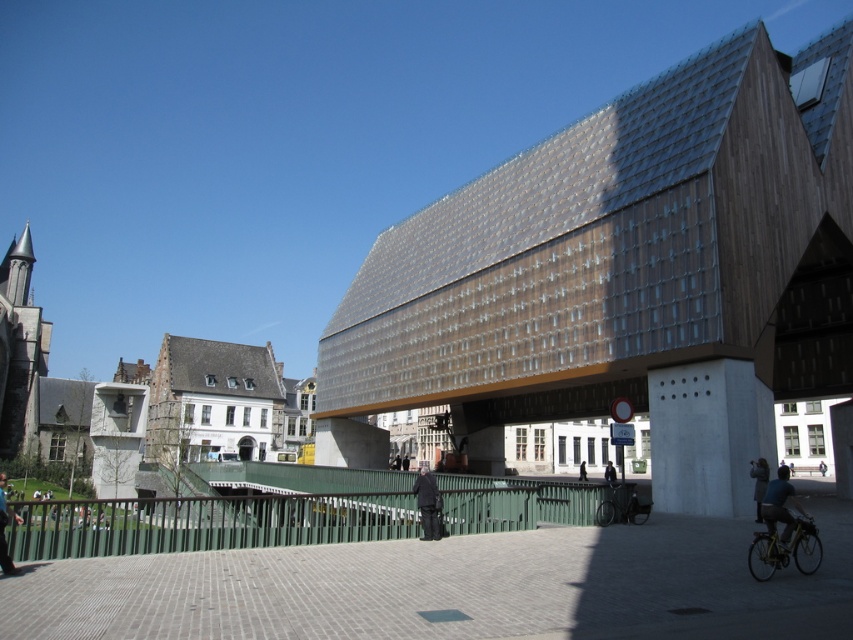
Find the location of a particular element. dark gray coat at center is located at coordinates (759, 483).

Does point (766, 468) come closer to viewer compared to point (579, 461)?

Yes, point (766, 468) is closer to viewer.

This screenshot has width=853, height=640. What are the coordinates of `dark gray coat at center` in the screenshot? It's located at (759, 483).

Does shiny metallic bicycle at lower right have a greater height compared to dark gray coat at center?

No, shiny metallic bicycle at lower right is not taller than dark gray coat at center.

From the picture: Which of these two, shiny metallic bicycle at lower right or dark gray coat at center, stands shorter?

shiny metallic bicycle at lower right is shorter.

Does point (772, 524) come in front of point (763, 461)?

Yes, point (772, 524) is closer to viewer.

The height and width of the screenshot is (640, 853). I want to click on shiny metallic bicycle at lower right, so click(785, 548).

Is point (422, 481) positioned behind point (612, 467)?

No, it is not.

Which of these two, dark gray suit at center or dark blue jacket at center, stands taller?

dark blue jacket at center is taller.

Which is behind, point (424, 481) or point (606, 474)?

The point (606, 474) is behind.

This screenshot has height=640, width=853. What are the coordinates of `dark gray suit at center` in the screenshot? It's located at (427, 504).